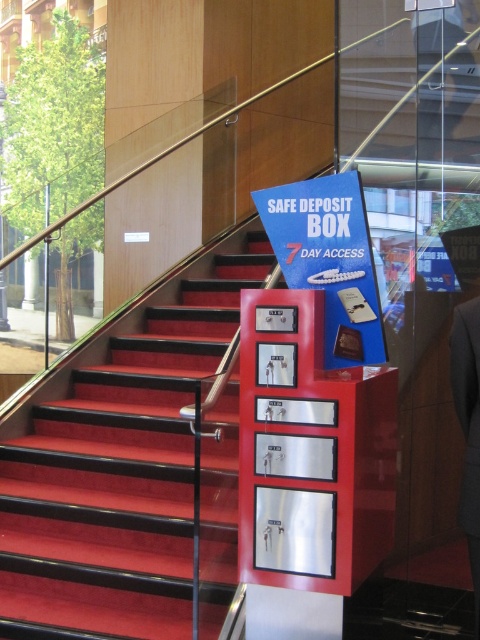
Can you confirm if red carpeted stairs at center is positioned to the left of dark gray suit at center?

Indeed, red carpeted stairs at center is positioned on the left side of dark gray suit at center.

The height and width of the screenshot is (640, 480). What are the coordinates of `red carpeted stairs at center` in the screenshot? It's located at (132, 480).